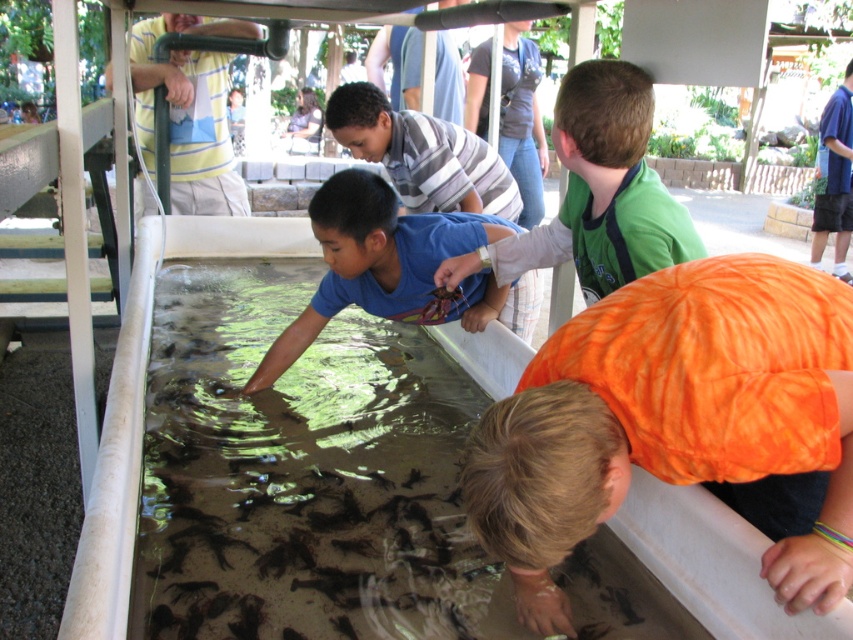
Question: Among these points, which one is farthest from the camera?

Choices:
 (A) pos(357,275)
 (B) pos(743,282)
 (C) pos(630,136)

Answer: (A)

Question: Can you confirm if green matte shirt at upper center is positioned above blue shirt at upper center?

Choices:
 (A) no
 (B) yes

Answer: (A)

Question: Is orange tie-dye shirt at lower right smaller than green matte shirt at upper center?

Choices:
 (A) yes
 (B) no

Answer: (A)

Question: Which object is positioned closest to the orange tie-dye shirt at lower right?

Choices:
 (A) blue shirt at upper center
 (B) green matte shirt at upper center

Answer: (B)

Question: Can you confirm if clear plastic tank at center is bigger than blue shirt at upper center?

Choices:
 (A) no
 (B) yes

Answer: (B)

Question: Which point appears closest to the camera in this image?

Choices:
 (A) (517, 237)
 (B) (360, 444)
 (C) (599, 422)

Answer: (C)